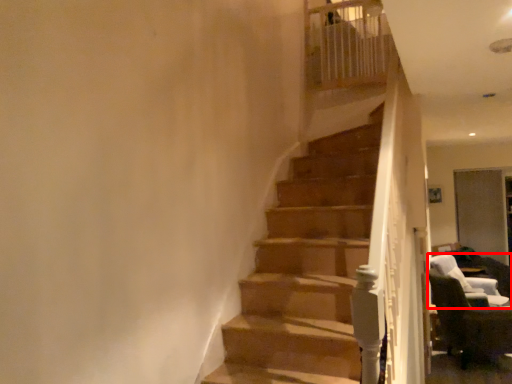
Question: From the image's perspective, considering the relative positions of chair (annotated by the red box) and chair in the image provided, where is chair (annotated by the red box) located with respect to the staircase?

Choices:
 (A) below
 (B) above

Answer: (B)